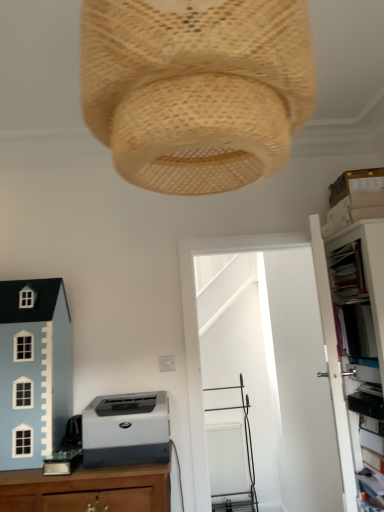
Question: Considering the relative sizes of white plastic file cabinet at right and woven beige lampshade at upper center in the image provided, is white plastic file cabinet at right smaller than woven beige lampshade at upper center?

Choices:
 (A) yes
 (B) no

Answer: (B)

Question: Does white plastic file cabinet at right contain woven beige lampshade at upper center?

Choices:
 (A) yes
 (B) no

Answer: (B)

Question: From a real-world perspective, is white plastic file cabinet at right on top of woven beige lampshade at upper center?

Choices:
 (A) yes
 (B) no

Answer: (B)

Question: Considering the relative sizes of white plastic file cabinet at right and woven beige lampshade at upper center in the image provided, is white plastic file cabinet at right bigger than woven beige lampshade at upper center?

Choices:
 (A) no
 (B) yes

Answer: (B)

Question: Does white plastic file cabinet at right appear on the right side of woven beige lampshade at upper center?

Choices:
 (A) yes
 (B) no

Answer: (A)

Question: Does white plastic file cabinet at right come in front of woven beige lampshade at upper center?

Choices:
 (A) no
 (B) yes

Answer: (A)

Question: Does gray matte printer at lower left come behind light blue painted wood toy house at lower left?

Choices:
 (A) yes
 (B) no

Answer: (B)

Question: From the image's perspective, does gray matte printer at lower left appear lower than light blue painted wood toy house at lower left?

Choices:
 (A) no
 (B) yes

Answer: (B)

Question: Does gray matte printer at lower left have a lesser height compared to light blue painted wood toy house at lower left?

Choices:
 (A) no
 (B) yes

Answer: (B)

Question: Is gray matte printer at lower left smaller than light blue painted wood toy house at lower left?

Choices:
 (A) yes
 (B) no

Answer: (A)

Question: Can you confirm if gray matte printer at lower left is thinner than light blue painted wood toy house at lower left?

Choices:
 (A) no
 (B) yes

Answer: (A)

Question: Is gray matte printer at lower left facing towards light blue painted wood toy house at lower left?

Choices:
 (A) yes
 (B) no

Answer: (B)

Question: Is woven beige lampshade at upper center closer to the viewer compared to light blue painted wood toy house at lower left?

Choices:
 (A) yes
 (B) no

Answer: (A)